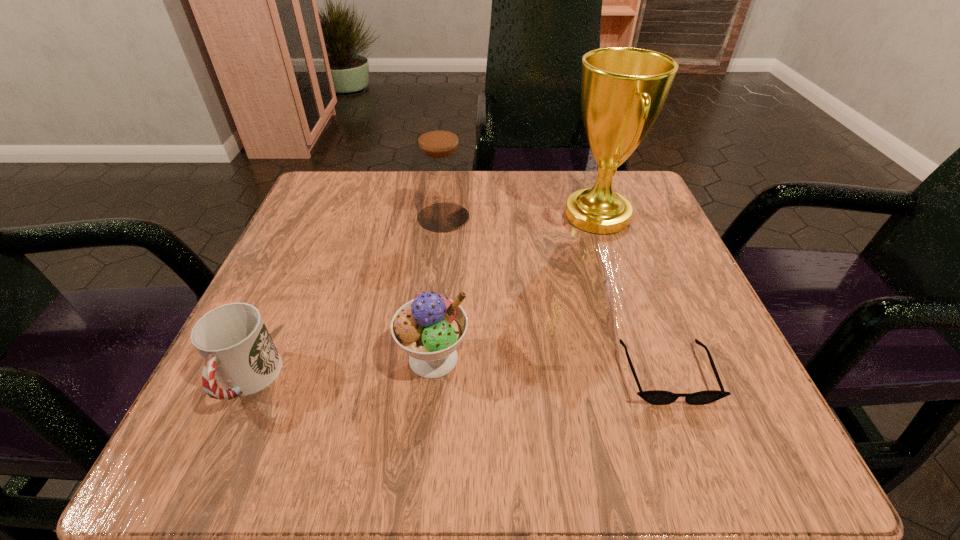
Identify the location of free spot between the shortest object and the cup. This screenshot has width=960, height=540. (x=457, y=377).

This screenshot has height=540, width=960. In order to click on vacant space that's between the tallest object and the shortest object in this screenshot , I will do `click(632, 294)`.

The height and width of the screenshot is (540, 960). I want to click on empty space between the second tallest object and the sunglasses, so click(x=555, y=295).

Locate an element on the screen. vacant point located between the leftmost object and the jar is located at coordinates (345, 299).

Where is `empty space that is in between the second tallest object and the second shortest object`? empty space that is in between the second tallest object and the second shortest object is located at coordinates (345, 299).

Identify the location of free space that is in between the fourth tallest object and the second tallest object. (345, 299).

The image size is (960, 540). What are the coordinates of `unoccupied area between the third shortest object and the fourth tallest object` in the screenshot? It's located at (340, 369).

Where is `vacant region between the third shortest object and the shortest object`? vacant region between the third shortest object and the shortest object is located at coordinates (550, 366).

Locate an element on the screen. This screenshot has height=540, width=960. object that is the second nearest to the jar is located at coordinates (429, 328).

What are the coordinates of `the third closest object relative to the fourth shortest object` in the screenshot? It's located at (233, 341).